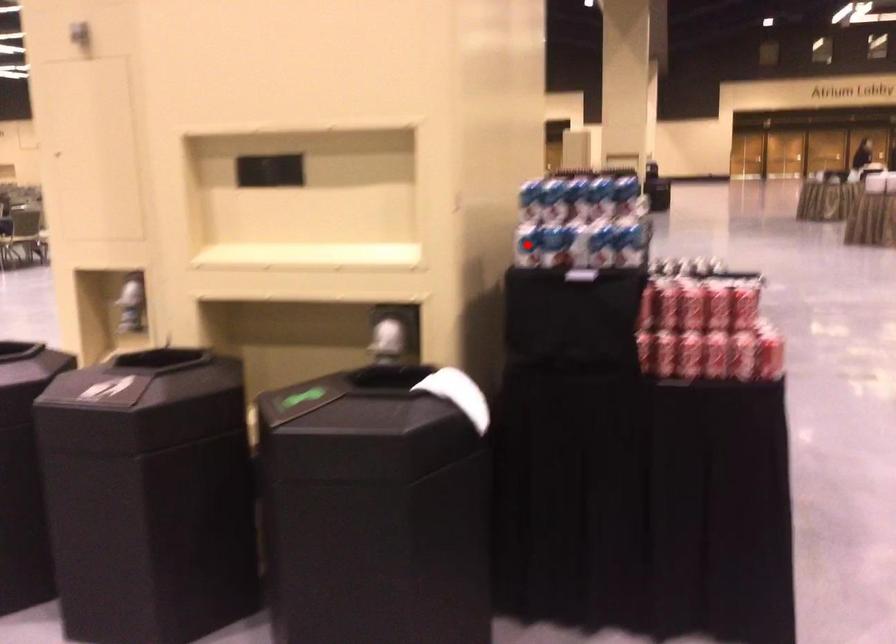
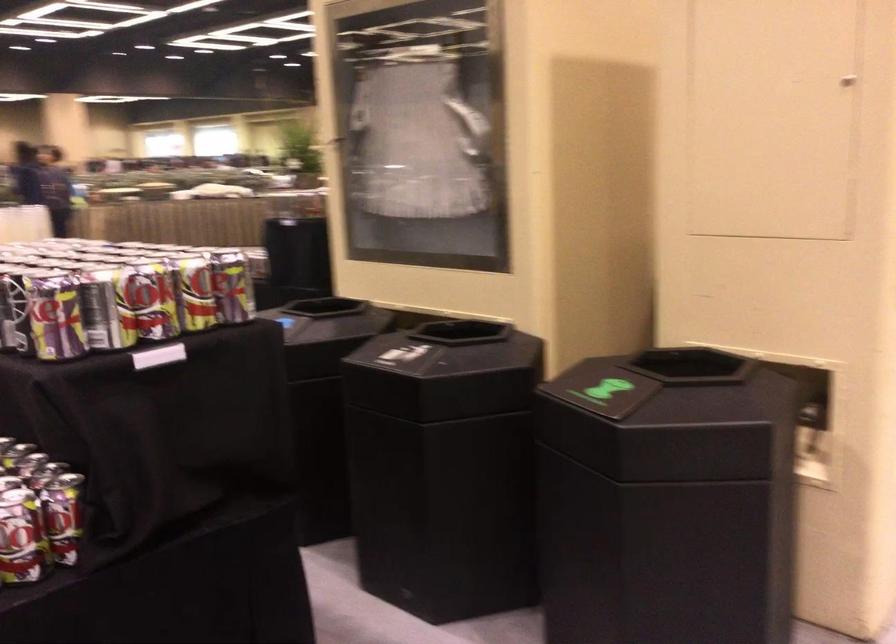
Question: I am providing you with two images of the same scene from different viewpoints. A red point is marked on the first image. Can you still see the location of the red point in image 2?

Choices:
 (A) Yes
 (B) No

Answer: (B)